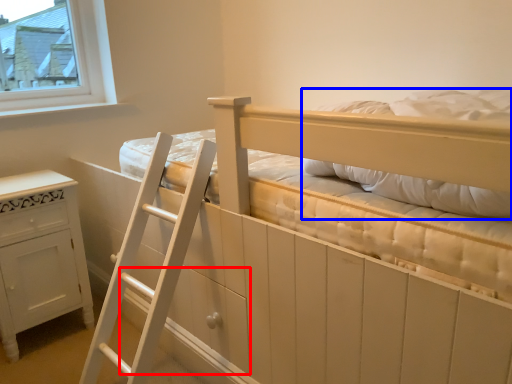
Question: Among these objects, which one is nearest to the camera, drawer (highlighted by a red box) or pillow (highlighted by a blue box)?

Choices:
 (A) drawer
 (B) pillow

Answer: (B)